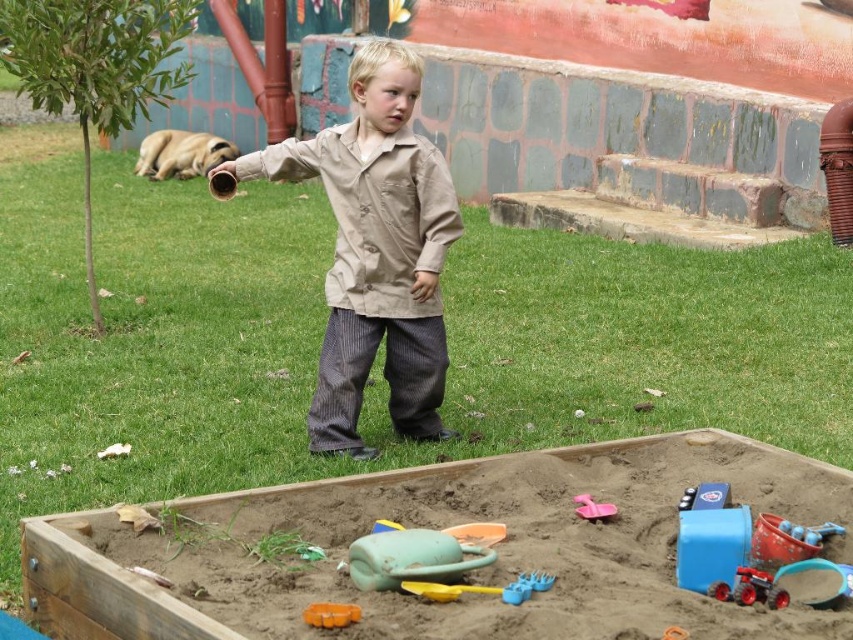
You are a parent trying to ensure your child can safely play in the sandbox. Based on the scene, can the child see over the edge of the brown sandy sandbox at lower center while standing next to the tan fabric shirt at center?

The brown sandy sandbox at lower center is not as tall as tan fabric shirt at center. Since the sandbox is shorter than the child wearing the tan fabric shirt, the child can see over the edge of the brown sandy sandbox at lower center.

The child is holding a small cylindrical object. Which object in the scene is closer to the child, the brown sandy sandbox at lower center or the green rubber shovel at lower center?

The green rubber shovel at lower center is closer to the child because the brown sandy sandbox at lower center is positioned on the right side of the shovel, meaning the shovel is nearer to the child.